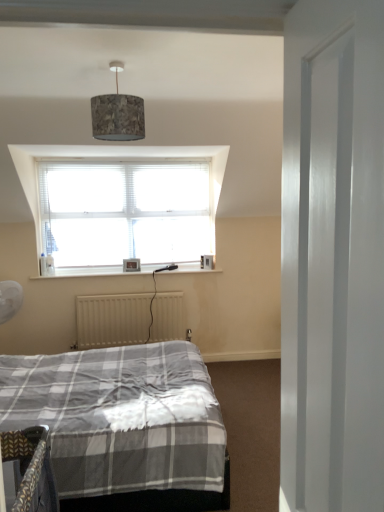
Question: In terms of width, does textured fabric lampshade at upper center look wider or thinner when compared to beige matte radiator at lower center?

Choices:
 (A) wide
 (B) thin

Answer: (A)

Question: Is point (114, 101) positioned closer to the camera than point (127, 330)?

Choices:
 (A) closer
 (B) farther

Answer: (A)

Question: From the image's perspective, is textured fabric lampshade at upper center positioned above or below beige matte radiator at lower center?

Choices:
 (A) below
 (B) above

Answer: (B)

Question: Is beige matte radiator at lower center wider or thinner than textured fabric lampshade at upper center?

Choices:
 (A) wide
 (B) thin

Answer: (B)

Question: Visually, is beige matte radiator at lower center positioned to the left or to the right of textured fabric lampshade at upper center?

Choices:
 (A) left
 (B) right

Answer: (A)

Question: Considering the positions of beige matte radiator at lower center and textured fabric lampshade at upper center in the image, is beige matte radiator at lower center bigger or smaller than textured fabric lampshade at upper center?

Choices:
 (A) big
 (B) small

Answer: (A)

Question: Does point (77, 313) appear closer or farther from the camera than point (94, 126)?

Choices:
 (A) farther
 (B) closer

Answer: (A)